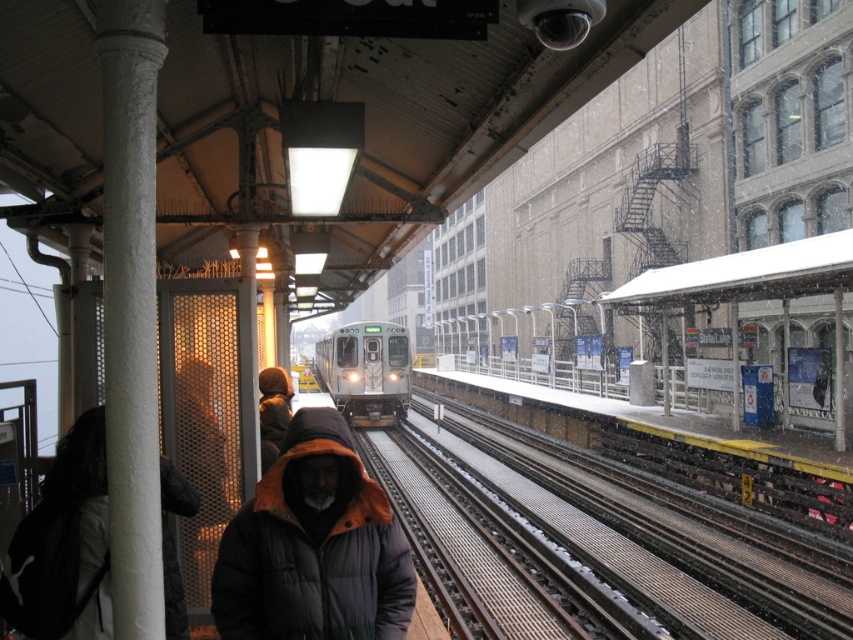
Question: Does silver metallic train at center have a larger size compared to brown leather jacket at center?

Choices:
 (A) yes
 (B) no

Answer: (A)

Question: Is dark puffy jacket at center wider than silver metallic train at center?

Choices:
 (A) yes
 (B) no

Answer: (B)

Question: Estimate the real-world distances between objects in this image. Which object is farther from the dark gray hooded jacket at left?

Choices:
 (A) silver metallic train at center
 (B) dark puffy jacket at center

Answer: (A)

Question: Which of these objects is positioned farthest from the silver metallic train at center?

Choices:
 (A) dark gray hooded jacket at left
 (B) dark puffy jacket at center

Answer: (B)

Question: Can you confirm if dark puffy jacket at center is positioned above brown leather jacket at center?

Choices:
 (A) yes
 (B) no

Answer: (A)

Question: Based on their relative distances, which object is farther from the brown leather jacket at center?

Choices:
 (A) silver metallic train at center
 (B) dark gray hooded jacket at left

Answer: (A)